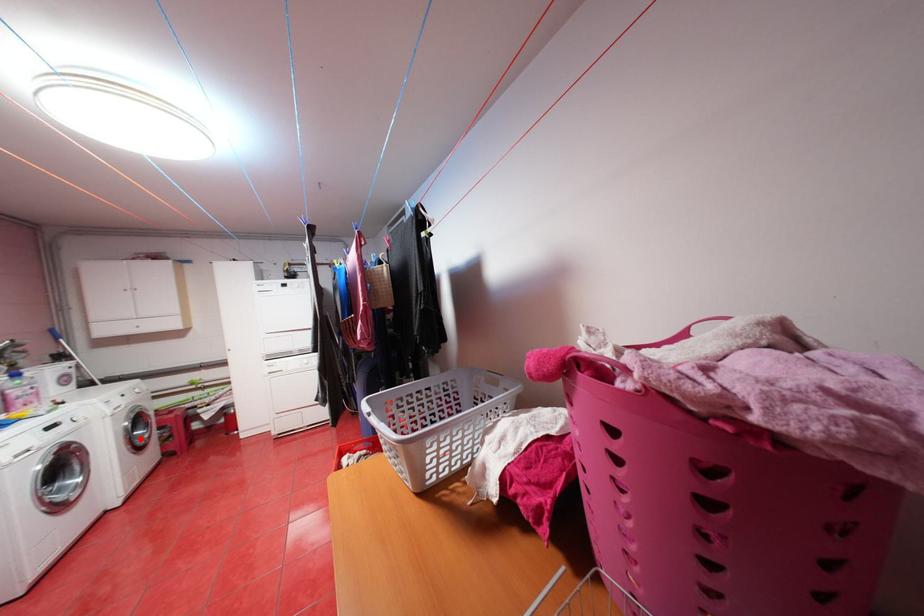
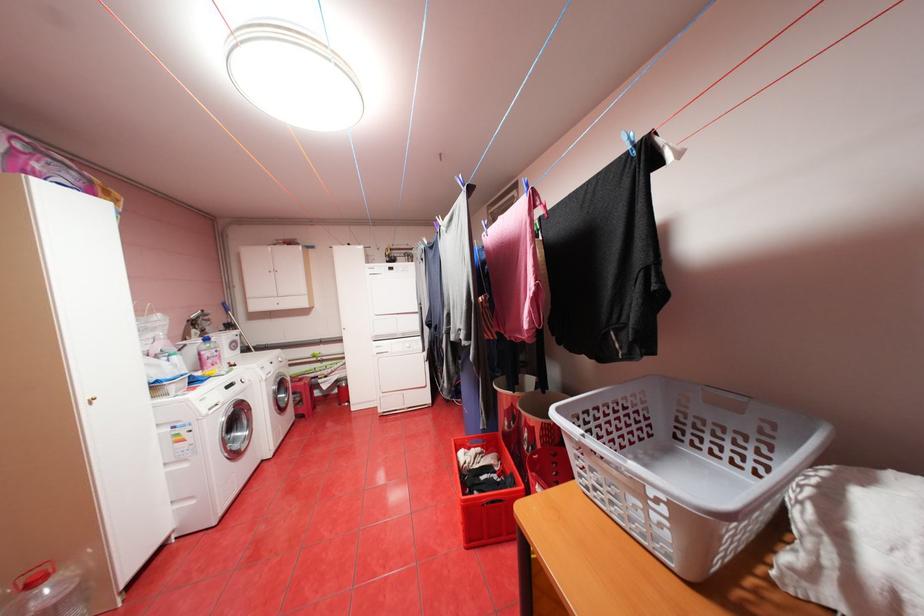
The point at the highlighted location is marked in the first image. Where is the corresponding point in the second image?

(286, 400)